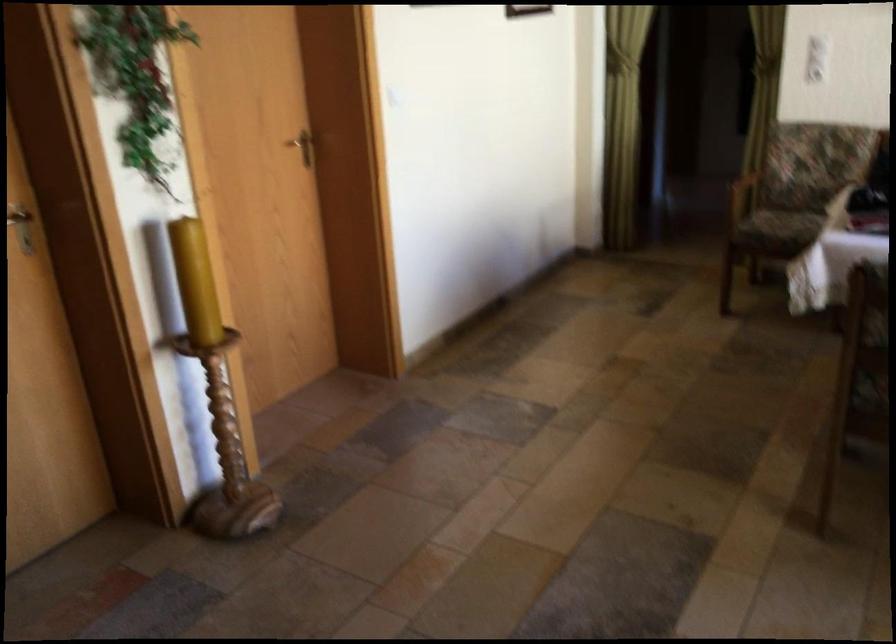
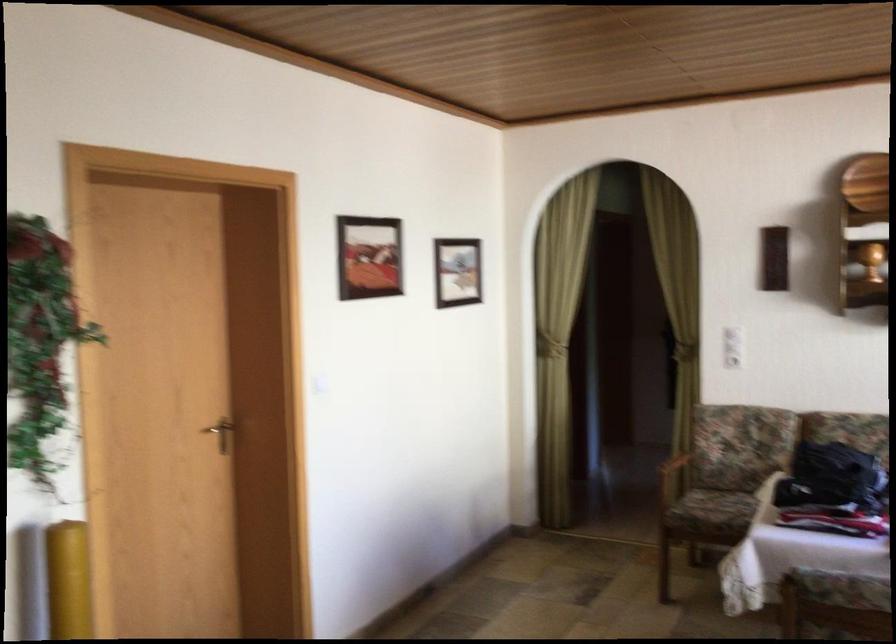
The images are taken continuously from a first-person perspective. In which direction are you moving?

The cameraman walked toward right, forward.